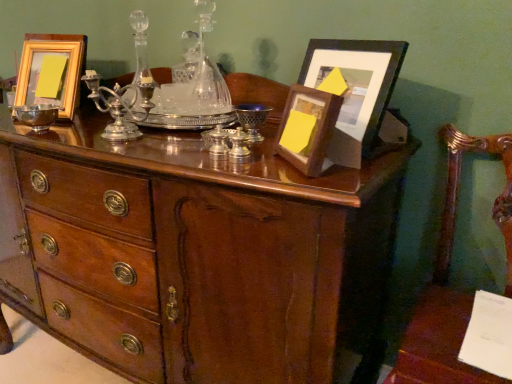
At what (x,y) coordinates should I click in order to perform the action: click on blank space situated above white paper at lower right (from a real-world perspective). Please return your answer as a coordinate pair (x, y). This screenshot has width=512, height=384. Looking at the image, I should click on tap(466, 332).